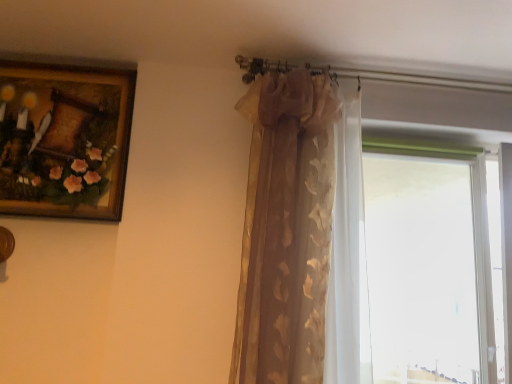
Question: Is point (321, 175) positioned closer to the camera than point (489, 208)?

Choices:
 (A) closer
 (B) farther

Answer: (A)

Question: From the image's perspective, is gold textured curtain at upper center located above or below transparent glass window at right?

Choices:
 (A) below
 (B) above

Answer: (B)

Question: Which object is positioned closest to the gold textured curtain at upper center?

Choices:
 (A) transparent glass window at right
 (B) wooden framed painting at upper left

Answer: (B)

Question: Estimate the real-world distances between objects in this image. Which object is farther from the wooden framed painting at upper left?

Choices:
 (A) transparent glass window at right
 (B) gold textured curtain at upper center

Answer: (A)